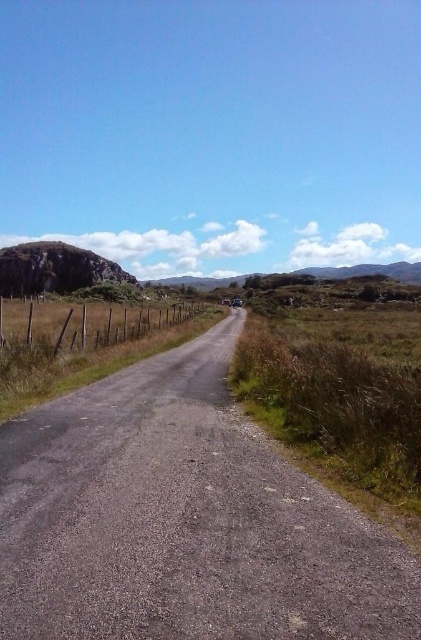
Question: Does gray asphalt road at center have a greater width compared to brown wooden fence at left?

Choices:
 (A) no
 (B) yes

Answer: (A)

Question: Which object appears farthest from the camera in this image?

Choices:
 (A) gray asphalt road at center
 (B) brown wooden fence at left

Answer: (B)

Question: Is gray asphalt road at center further to camera compared to brown wooden fence at left?

Choices:
 (A) no
 (B) yes

Answer: (A)

Question: Is gray asphalt road at center to the left of brown wooden fence at left from the viewer's perspective?

Choices:
 (A) no
 (B) yes

Answer: (A)